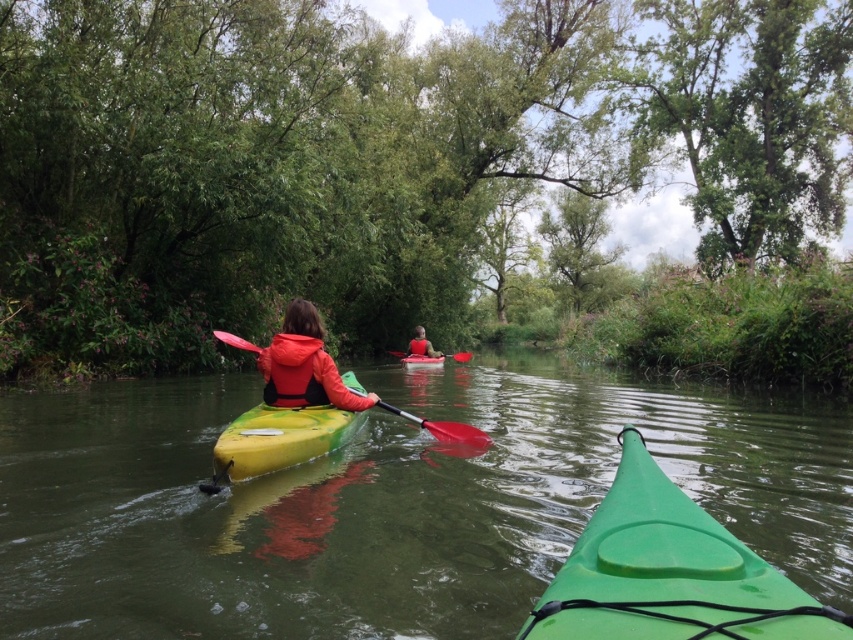
Question: Which point is farther from the camera taking this photo?

Choices:
 (A) (270, 426)
 (B) (416, 360)
 (C) (340, 385)

Answer: (B)

Question: Can you confirm if green matte canoe at center is positioned to the left of red plastic paddle at center?

Choices:
 (A) no
 (B) yes

Answer: (A)

Question: Can you confirm if green plastic kayak at center is wider than yellow plastic canoe at center?

Choices:
 (A) no
 (B) yes

Answer: (B)

Question: Which point appears farthest from the camera in this image?

Choices:
 (A) coord(350,387)
 (B) coord(422,330)

Answer: (B)

Question: Is green plastic kayak at center further to camera compared to matte red jacket at center?

Choices:
 (A) no
 (B) yes

Answer: (A)

Question: Which point is farther to the camera?

Choices:
 (A) (403, 355)
 (B) (227, 451)

Answer: (A)